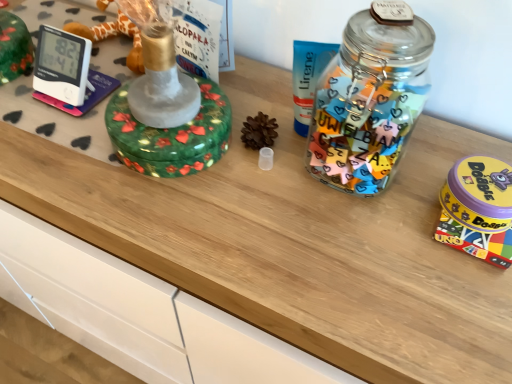
The height and width of the screenshot is (384, 512). I want to click on free spot behind transparent plastic pinecone at center, arranged as the second toy when viewed from the right, so click(x=262, y=97).